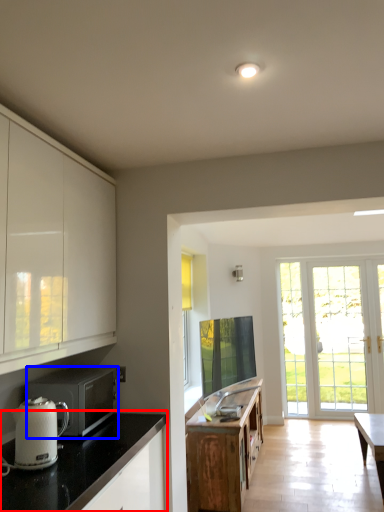
Question: Which object appears farthest to the camera in this image, countertop (highlighted by a red box) or microwave oven (highlighted by a blue box)?

Choices:
 (A) countertop
 (B) microwave oven

Answer: (B)